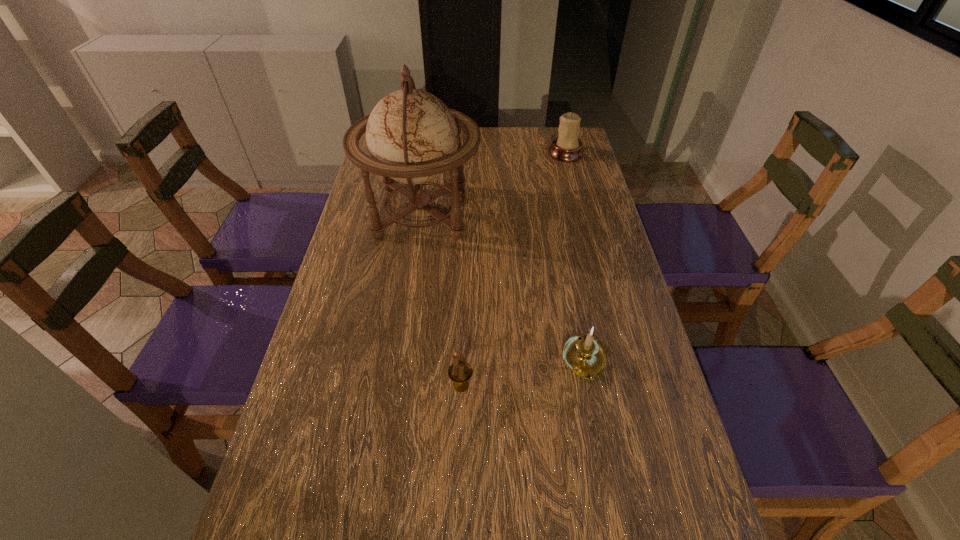
Locate an element on the screen. Image resolution: width=960 pixels, height=540 pixels. the tallest object is located at coordinates (412, 137).

Image resolution: width=960 pixels, height=540 pixels. Find the location of `the second farthest object`. the second farthest object is located at coordinates (412, 137).

Find the location of `the third shortest object`. the third shortest object is located at coordinates (567, 147).

Image resolution: width=960 pixels, height=540 pixels. I want to click on the tallest candle holder, so click(x=567, y=147).

Identify the location of the leftmost candle holder. Image resolution: width=960 pixels, height=540 pixels. (460, 372).

Where is `free space located at the front of the third nearest object showing Africa`? This screenshot has width=960, height=540. free space located at the front of the third nearest object showing Africa is located at coordinates (596, 212).

At what (x,y) coordinates should I click in order to perform the action: click on vacant region located 0.330m on the front of the farthest object. Please return your answer as a coordinate pair (x, y). The image size is (960, 540). Looking at the image, I should click on (584, 220).

Where is `free region located 0.090m on the right of the leftmost candle holder`? This screenshot has width=960, height=540. free region located 0.090m on the right of the leftmost candle holder is located at coordinates (514, 386).

Identify the location of object that is at the far edge. (567, 147).

Image resolution: width=960 pixels, height=540 pixels. I want to click on object located in the left edge section of the desktop, so click(412, 137).